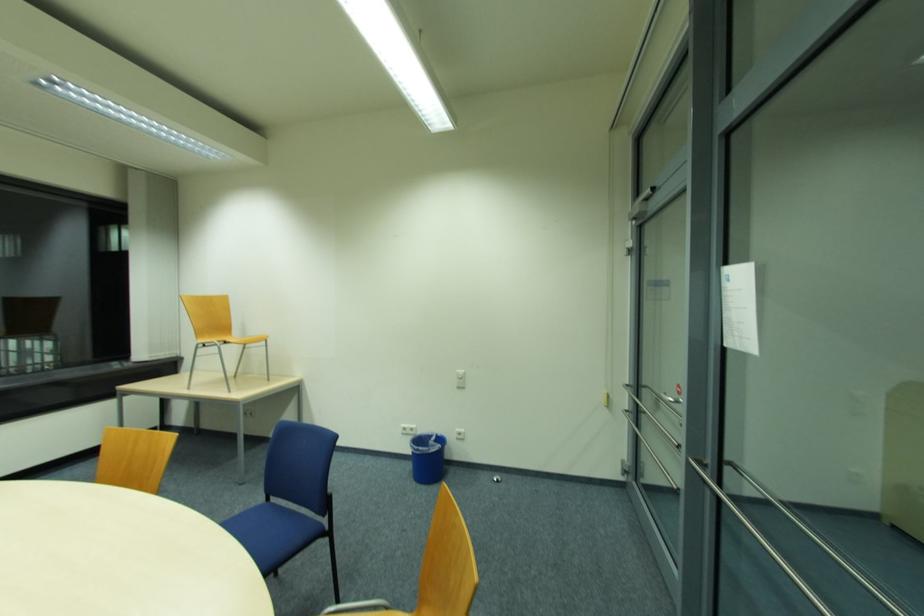
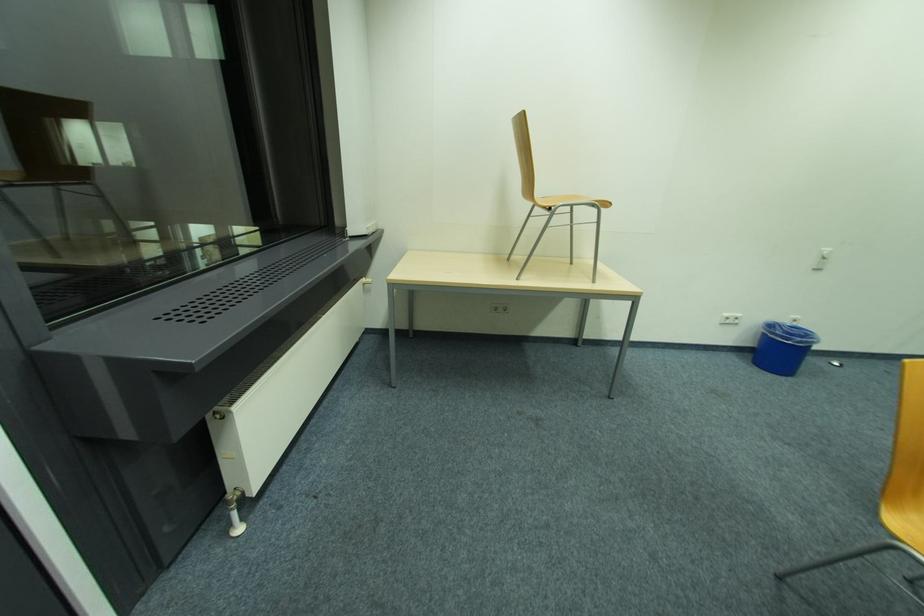
In a continuous first-person perspective shot, in which direction is the camera moving?

The movement direction of the cameraman is left, forward.